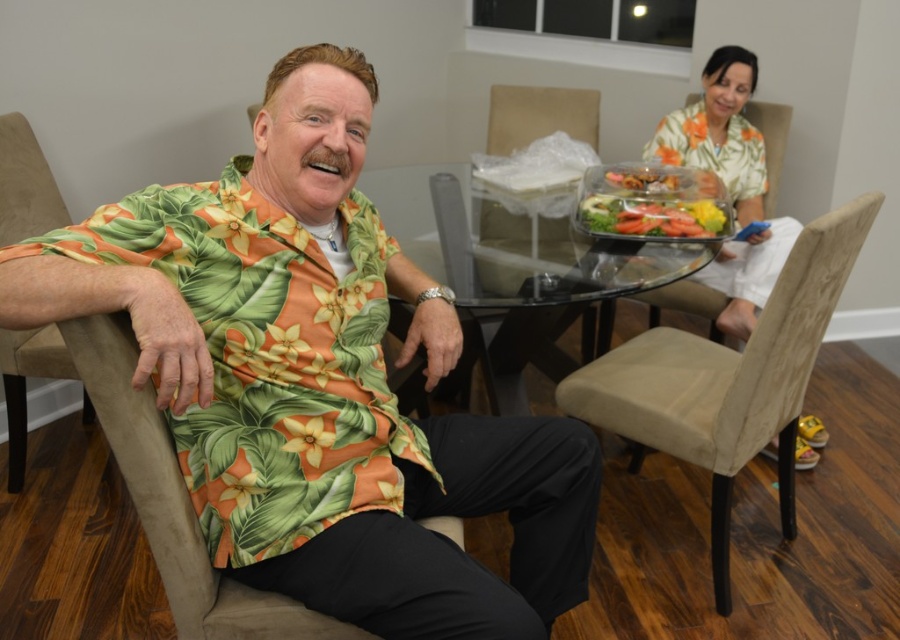
Question: Is beige fabric chair at lower right below beige fabric chair at center?

Choices:
 (A) yes
 (B) no

Answer: (A)

Question: Does translucent plastic container at center appear under beige fabric chair at center?

Choices:
 (A) yes
 (B) no

Answer: (A)

Question: Which object appears closest to the camera in this image?

Choices:
 (A) floral shirt at right
 (B) translucent plastic container at center
 (C) floral print shirt at left

Answer: (C)

Question: Which point is closer to the camera taking this photo?

Choices:
 (A) (756, 77)
 (B) (419, 269)

Answer: (B)

Question: Which object appears closest to the camera in this image?

Choices:
 (A) beige fabric chair at lower right
 (B) floral shirt at right
 (C) beige fabric chair at center
 (D) translucent plastic container at center

Answer: (A)

Question: Observing the image, what is the correct spatial positioning of translucent plastic container at center in reference to beige fabric chair at center?

Choices:
 (A) left
 (B) right

Answer: (B)